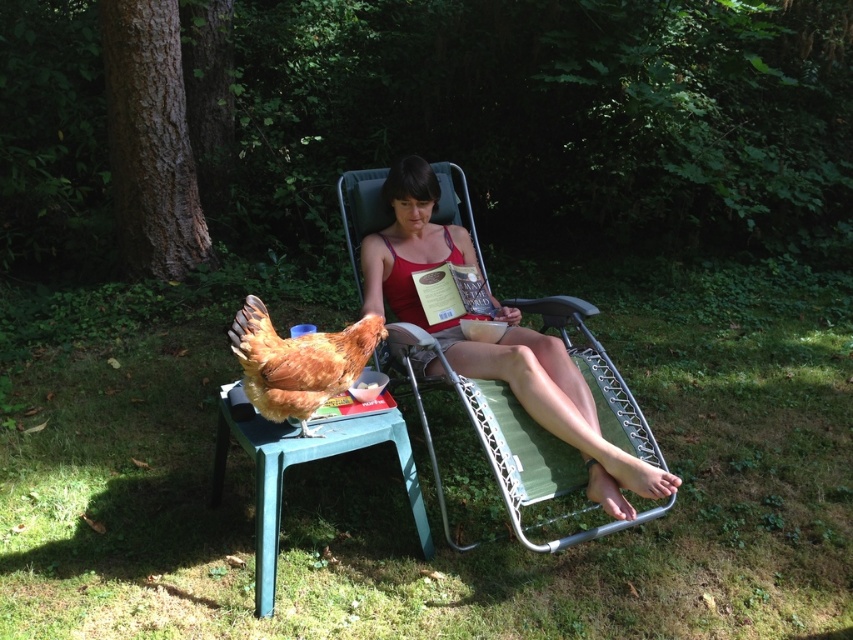
Question: Is matte red tank top at center to the right of brown feathered chicken at lower left from the viewer's perspective?

Choices:
 (A) no
 (B) yes

Answer: (B)

Question: Is matte red tank top at center thinner than brown feathered chicken at lower left?

Choices:
 (A) no
 (B) yes

Answer: (A)

Question: Among these objects, which one is nearest to the camera?

Choices:
 (A) brown feathered chicken at lower left
 (B) matte red tank top at center

Answer: (A)

Question: Among these points, which one is nearest to the camera?

Choices:
 (A) (416, 241)
 (B) (363, 346)

Answer: (B)

Question: Where is matte red tank top at center located in relation to brown feathered chicken at lower left in the image?

Choices:
 (A) left
 (B) right

Answer: (B)

Question: Which point is farther to the camera?

Choices:
 (A) brown feathered chicken at lower left
 (B) matte red tank top at center

Answer: (B)